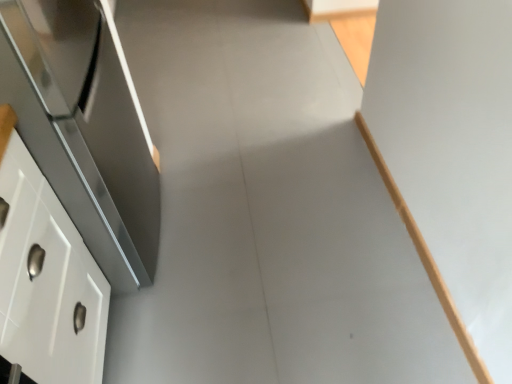
Identify the location of satin silver oven at left. The height and width of the screenshot is (384, 512). (85, 128).

Describe the element at coordinates (85, 128) in the screenshot. The width and height of the screenshot is (512, 384). I see `satin silver oven at left` at that location.

Identify the location of satin silver oven at left. (85, 128).